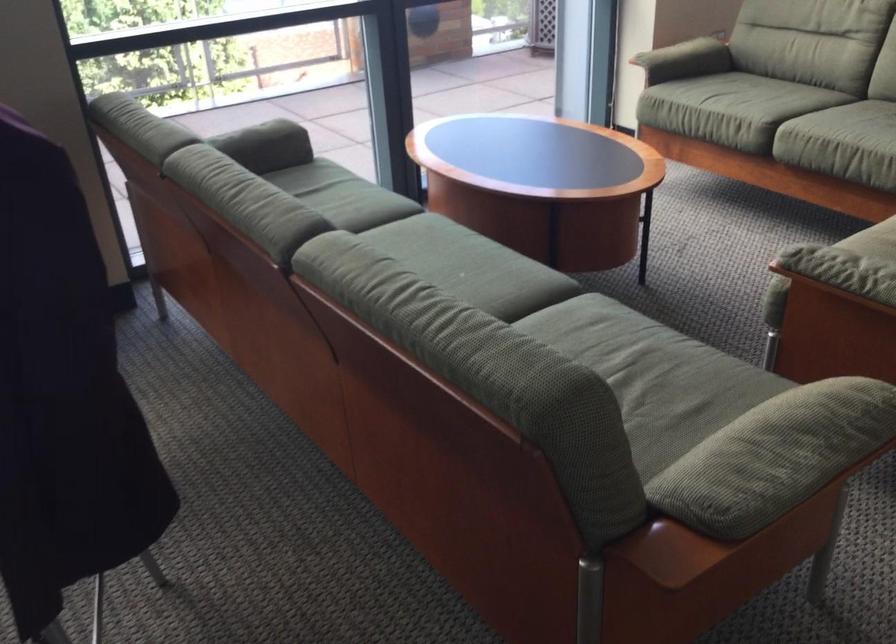
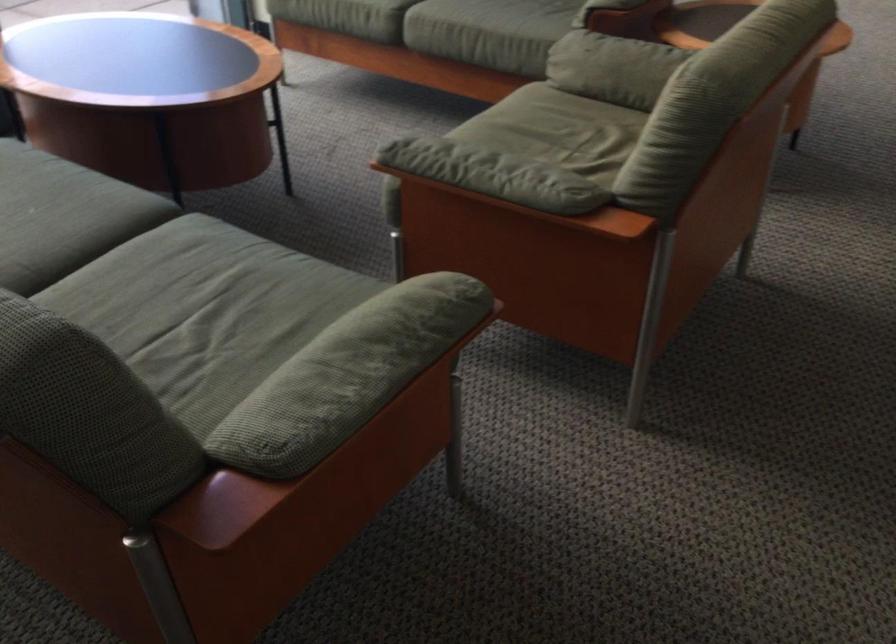
The images are taken continuously from a first-person perspective. In which direction are you moving?

The movement direction of the cameraman is right, forward.